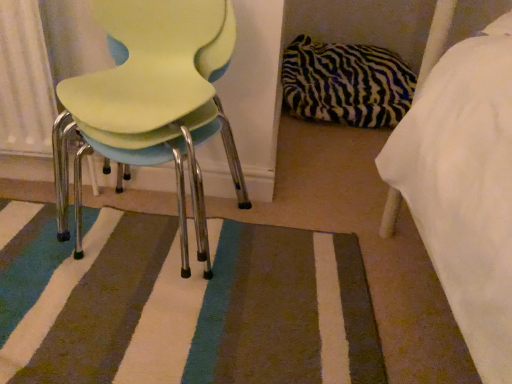
Question: Is striped carpet at center outside of matte plastic chair at left?

Choices:
 (A) no
 (B) yes

Answer: (B)

Question: Are striped carpet at center and matte plastic chair at left beside each other?

Choices:
 (A) yes
 (B) no

Answer: (B)

Question: Considering the relative positions of striped carpet at center and matte plastic chair at left in the image provided, is striped carpet at center to the left of matte plastic chair at left from the viewer's perspective?

Choices:
 (A) no
 (B) yes

Answer: (B)

Question: Can you confirm if striped carpet at center is bigger than matte plastic chair at left?

Choices:
 (A) no
 (B) yes

Answer: (A)

Question: From the image's perspective, is striped carpet at center located beneath matte plastic chair at left?

Choices:
 (A) no
 (B) yes

Answer: (B)

Question: Could matte plastic chair at left be considered to be inside striped carpet at center?

Choices:
 (A) no
 (B) yes

Answer: (A)

Question: Is zebra-patterned pillow at center-right bigger than striped carpet at center?

Choices:
 (A) no
 (B) yes

Answer: (B)

Question: Can you confirm if zebra-patterned pillow at center-right is positioned to the right of striped carpet at center?

Choices:
 (A) yes
 (B) no

Answer: (A)

Question: Is zebra-patterned pillow at center-right aimed at striped carpet at center?

Choices:
 (A) no
 (B) yes

Answer: (B)

Question: Is zebra-patterned pillow at center-right smaller than striped carpet at center?

Choices:
 (A) yes
 (B) no

Answer: (B)

Question: From a real-world perspective, is zebra-patterned pillow at center-right positioned over striped carpet at center based on gravity?

Choices:
 (A) no
 (B) yes

Answer: (B)

Question: Is zebra-patterned pillow at center-right completely or partially outside of striped carpet at center?

Choices:
 (A) no
 (B) yes

Answer: (B)

Question: Does striped carpet at center have a greater height compared to zebra-patterned pillow at center-right?

Choices:
 (A) no
 (B) yes

Answer: (A)